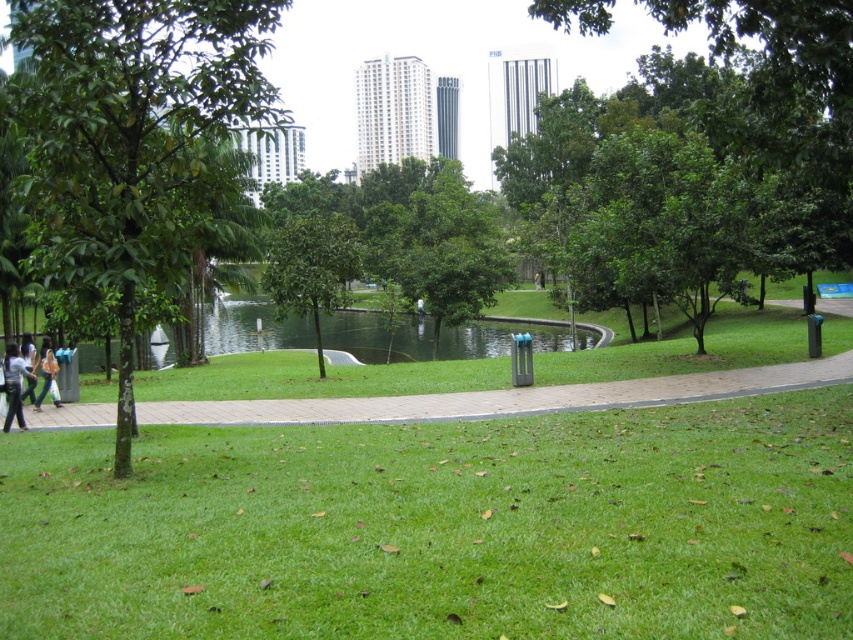
Question: Is light blue shirt at lower left to the right of orange fabric bag at lower left from the viewer's perspective?

Choices:
 (A) yes
 (B) no

Answer: (A)

Question: Which of the following is the closest to the observer?

Choices:
 (A) light brown leather jacket at lower left
 (B) light blue shirt at lower left
 (C) green leafy tree at center

Answer: (B)

Question: Which object is the farthest from the green grassy at center?

Choices:
 (A) light brown leather jacket at lower left
 (B) light blue shirt at lower left
 (C) concrete paved path at lower center

Answer: (A)

Question: Can you confirm if concrete paved path at lower center is wider than green leafy tree at center?

Choices:
 (A) no
 (B) yes

Answer: (B)

Question: Can you confirm if light blue shirt at lower left is smaller than orange fabric bag at lower left?

Choices:
 (A) no
 (B) yes

Answer: (A)

Question: Estimate the real-world distances between objects in this image. Which object is farther from the green leafy tree at center?

Choices:
 (A) green leafy tree at left
 (B) orange fabric bag at lower left
 (C) light blue shirt at lower left
 (D) green grassy at center

Answer: (D)